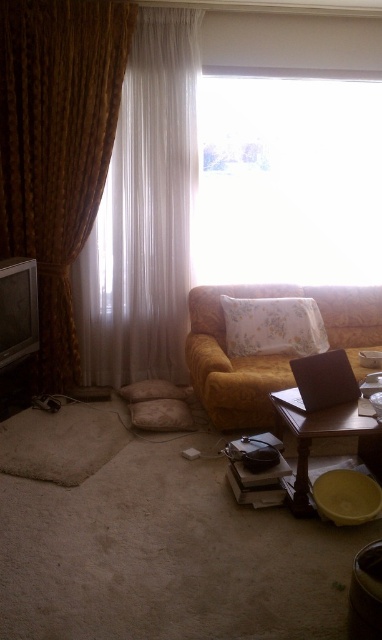
Does gold textured curtain at left appear under floral fabric pillow at center?

Incorrect, gold textured curtain at left is not positioned below floral fabric pillow at center.

Can you confirm if gold textured curtain at left is shorter than floral fabric pillow at center?

Incorrect, gold textured curtain at left's height does not fall short of floral fabric pillow at center's.

Who is more distant from viewer, (95, 76) or (258, 339)?

The point (258, 339) is behind.

Image resolution: width=382 pixels, height=640 pixels. In order to click on gold textured curtain at left in this screenshot , I will do `click(56, 148)`.

Is transparent glass window at upper center taller than white sheer curtain at left?

No.

Is transparent glass window at upper center above white sheer curtain at left?

Yes.

What do you see at coordinates (289, 179) in the screenshot?
I see `transparent glass window at upper center` at bounding box center [289, 179].

Identify the location of transparent glass window at upper center. The height and width of the screenshot is (640, 382). (289, 179).

Can you confirm if floral fabric pillow at center is positioned to the left of wooden table at lower right?

In fact, floral fabric pillow at center is to the right of wooden table at lower right.

Between floral fabric pillow at center and wooden table at lower right, which one appears on the left side from the viewer's perspective?

Positioned to the left is wooden table at lower right.

Between point (307, 301) and point (307, 460), which one is positioned behind?

Point (307, 301)

The image size is (382, 640). I want to click on floral fabric pillow at center, so [x=273, y=326].